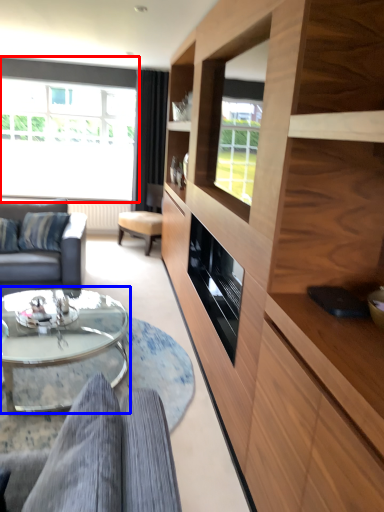
Question: Which object appears farthest to the camera in this image, window (highlighted by a red box) or coffee table (highlighted by a blue box)?

Choices:
 (A) window
 (B) coffee table

Answer: (A)